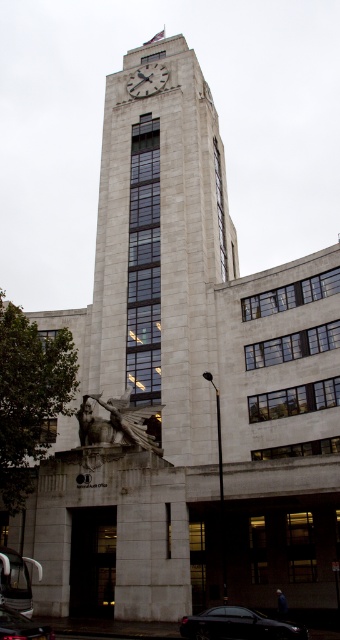
You are standing in front of the building and want to take a photo of both the bronze statue at lower left and the white stone clock at upper center. Which direction should you turn your camera to include both in the frame?

You should turn your camera to the right to include both the bronze statue at lower left and the white stone clock at upper center in the frame since the bronze statue at lower left is to the left of the white stone clock at upper center.